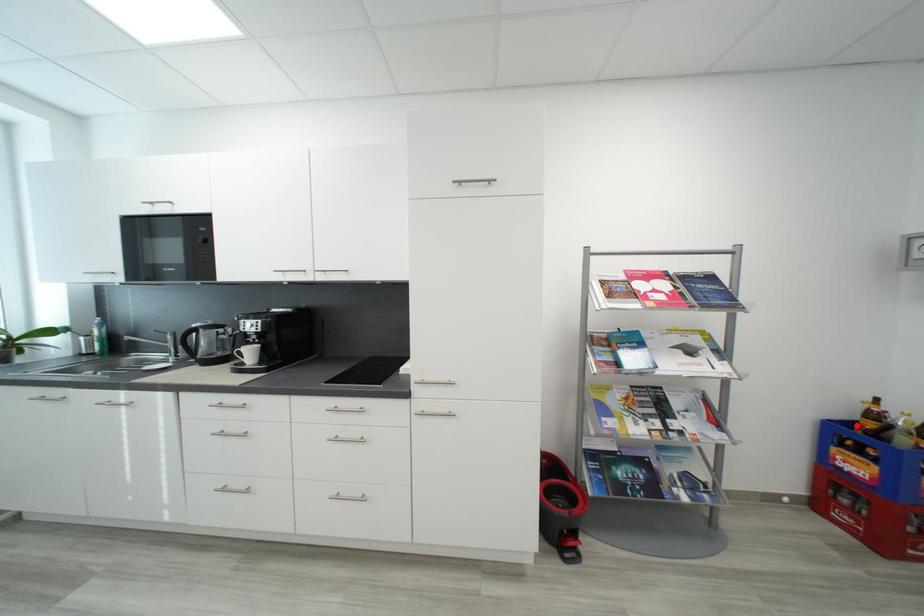
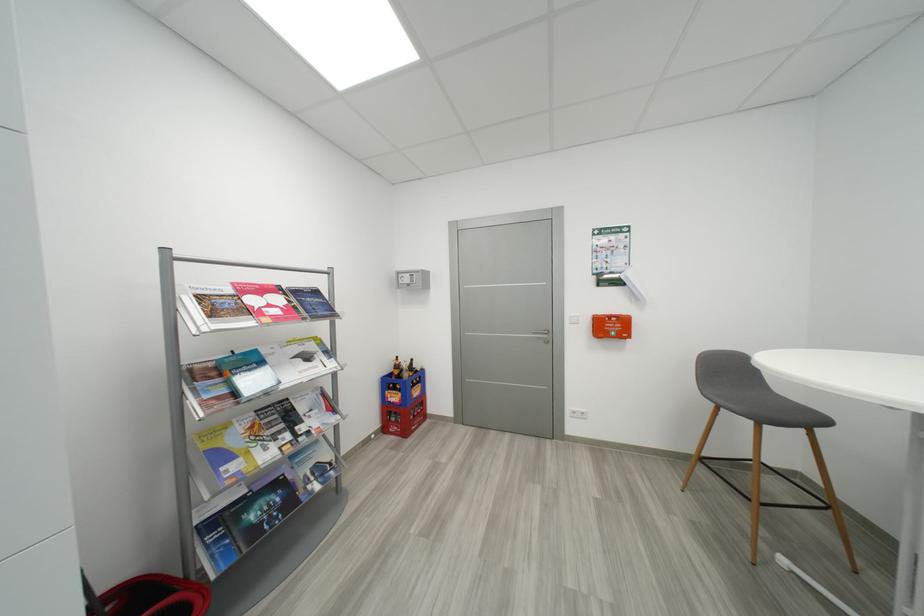
Question: I am providing you with two images of the same scene from different viewpoints. A red point is shown in image1. For the corresponding object point in image2, is it positioned nearer or farther from the camera?

Choices:
 (A) Nearer
 (B) Farther

Answer: (B)